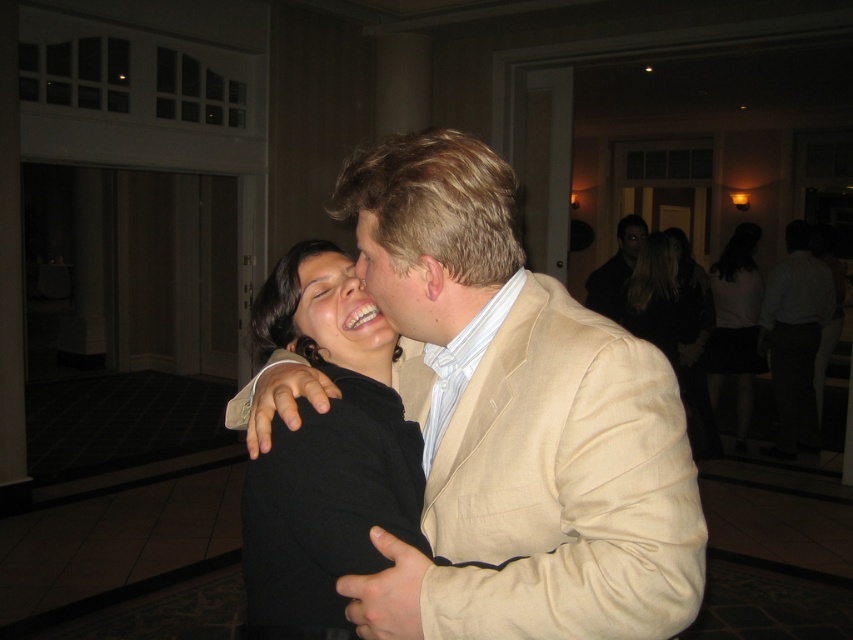
You are a photographer at the event and need to adjust the lighting to highlight both the beige linen suit at center and the black cotton shirt at upper right equally. Based on their positions, which direction should you move the light source to ensure both are illuminated properly?

The beige linen suit at center is to the left of the black cotton shirt at upper right. To ensure both are illuminated equally, move the light source to the right side so that it can evenly light both objects.

In the scene shown: You are organizing a charity event and need to arrange seating for two guests wearing the black fabric dress at center and black cotton shirt at upper right. The chairs available are standard size. Will both guests be able to sit comfortably without their clothing items overlapping the chairs?

The black fabric dress at center is wider than the black cotton shirt at upper right. Since the dress is wider, the guest wearing it may need a slightly wider chair to sit comfortably without the dress overlapping the chair. However, if the chairs are standard size, it might be tight for the dress but manageable for the shirt.

You are standing in the room where the image was taken. There is a black fabric dress at center represented by point (671, 321). If you want to place a small gift on the dress, where should you place it?

The black fabric dress at center is represented by point (671, 321), so you should place the small gift at the coordinates (671, 321) on the dress.